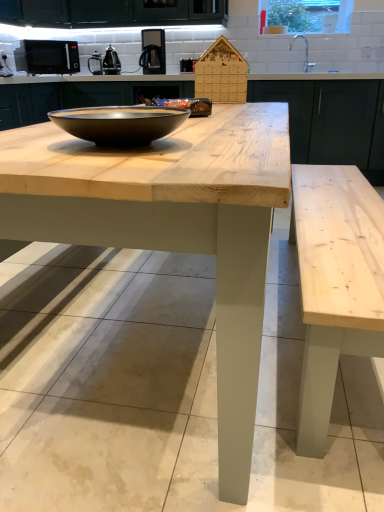
Where is `free point below natural wood table at center (from a real-world perspective)`? free point below natural wood table at center (from a real-world perspective) is located at coordinates (143, 334).